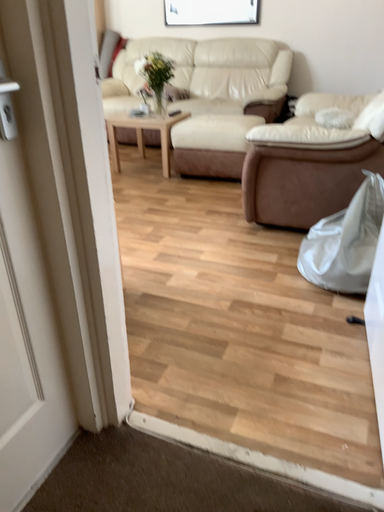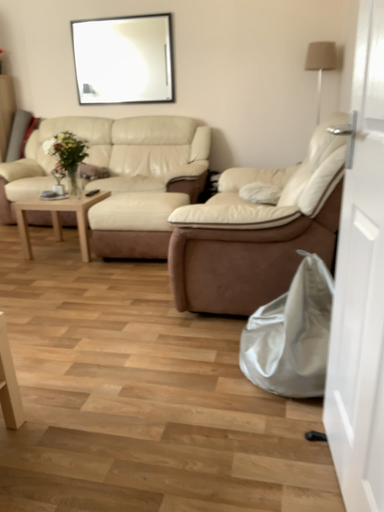
Question: Which way did the camera rotate in the video?

Choices:
 (A) rotated left
 (B) rotated right

Answer: (B)